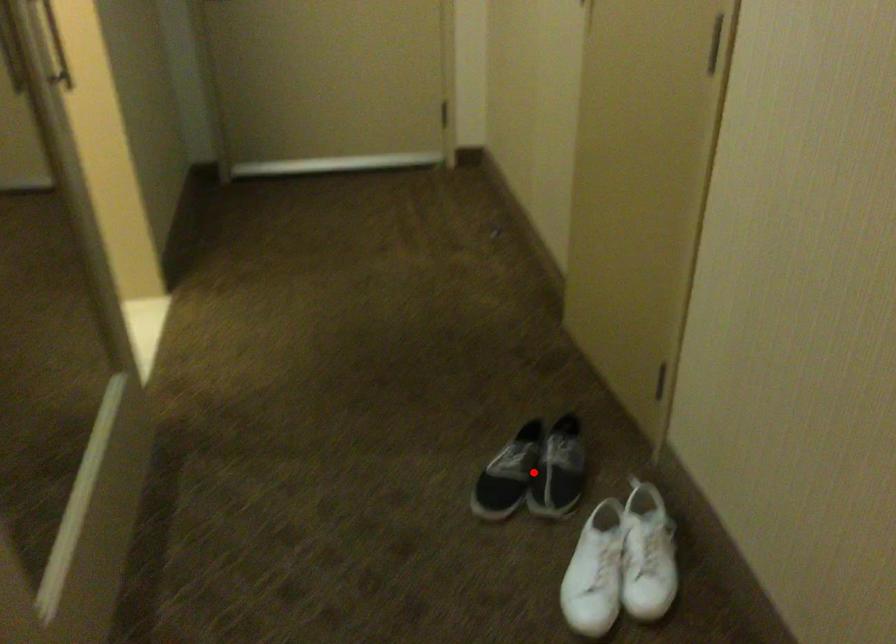
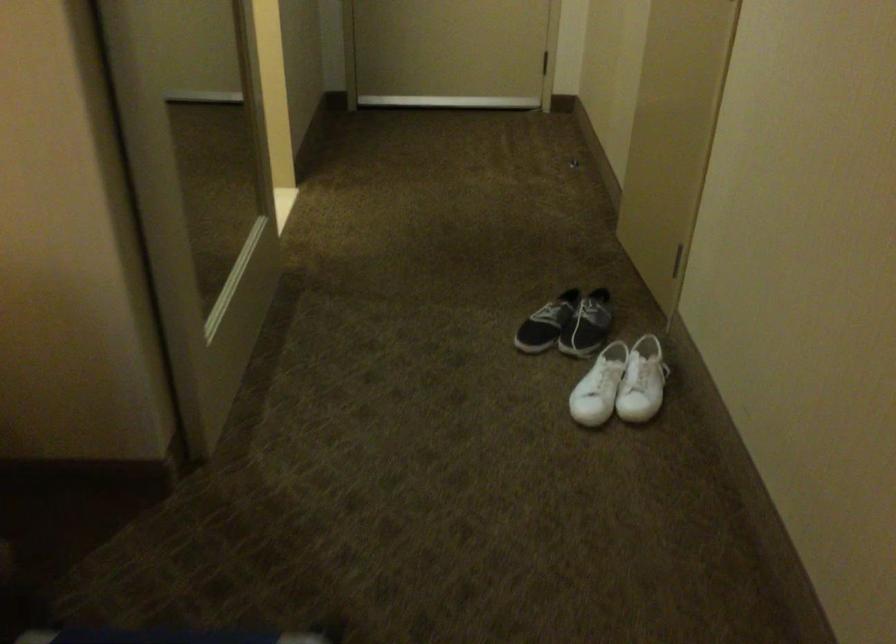
In the second image, find the point that corresponds to the highlighted location in the first image.

(567, 324)